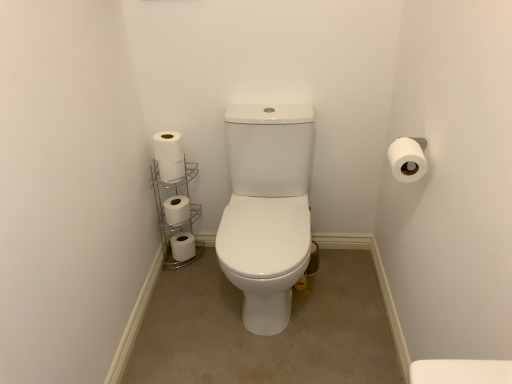
Question: Does white matte toilet paper at left, placed as the 4th toilet paper when sorted from back to front, have a greater height compared to white metallic toilet paper holder at lower left?

Choices:
 (A) no
 (B) yes

Answer: (A)

Question: Can you confirm if white matte toilet paper at left, placed as the 4th toilet paper when sorted from back to front, is positioned to the left of white metallic toilet paper holder at lower left?

Choices:
 (A) no
 (B) yes

Answer: (A)

Question: Is white metallic toilet paper holder at lower left at the back of white matte toilet paper at left, which is the 2th toilet paper from front to back?

Choices:
 (A) no
 (B) yes

Answer: (A)

Question: Is white matte toilet paper at left, acting as the 4th toilet paper starting from the left, directly adjacent to white metallic toilet paper holder at lower left?

Choices:
 (A) yes
 (B) no

Answer: (B)

Question: Can you confirm if white matte toilet paper at left, which is counted as the fifth toilet paper, starting from the bottom, is wider than white metallic toilet paper holder at lower left?

Choices:
 (A) yes
 (B) no

Answer: (B)

Question: From a real-world perspective, relative to white metallic toilet paper holder at lower left, is white matte toilet paper at left, arranged as the second toilet paper when viewed from the right, vertically above or below?

Choices:
 (A) below
 (B) above

Answer: (B)

Question: Considering the positions of point coord(161,157) and point coord(176,261), is point coord(161,157) closer or farther from the camera than point coord(176,261)?

Choices:
 (A) closer
 (B) farther

Answer: (A)

Question: Would you say white matte toilet paper at left, which is the 2th toilet paper from front to back, is inside or outside white metallic toilet paper holder at lower left?

Choices:
 (A) inside
 (B) outside

Answer: (B)

Question: From the image's perspective, is white matte toilet paper at left, which ranks as the first toilet paper in top-to-bottom order, located above or below white metallic toilet paper holder at lower left?

Choices:
 (A) below
 (B) above

Answer: (B)

Question: From a real-world perspective, is white matte toilet paper at lower left, the first toilet paper viewed from the back, physically located above or below white matte toilet paper at upper right, positioned as the 5th toilet paper in left-to-right order?

Choices:
 (A) above
 (B) below

Answer: (B)

Question: Is white matte toilet paper at lower left, arranged as the 1th toilet paper when ordered from the bottom, taller or shorter than white matte toilet paper at upper right, the third toilet paper ordered from the bottom?

Choices:
 (A) short
 (B) tall

Answer: (A)

Question: Considering the relative positions of white matte toilet paper at lower left, the first toilet paper viewed from the back, and white matte toilet paper at upper right, marked as the fifth toilet paper in a back-to-front arrangement, in the image provided, is white matte toilet paper at lower left, the first toilet paper viewed from the back, to the left or to the right of white matte toilet paper at upper right, marked as the fifth toilet paper in a back-to-front arrangement,?

Choices:
 (A) left
 (B) right

Answer: (A)

Question: Considering the positions of point (179, 258) and point (402, 170), is point (179, 258) closer or farther from the camera than point (402, 170)?

Choices:
 (A) farther
 (B) closer

Answer: (A)

Question: Is white metallic toilet paper holder at lower left spatially inside white matte toilet paper at lower left, which ranks as the 3th toilet paper in right-to-left order, or outside of it?

Choices:
 (A) outside
 (B) inside

Answer: (A)

Question: Considering the positions of white metallic toilet paper holder at lower left and white matte toilet paper at lower left, positioned as the fifth toilet paper in top-to-bottom order, in the image, is white metallic toilet paper holder at lower left bigger or smaller than white matte toilet paper at lower left, positioned as the fifth toilet paper in top-to-bottom order,?

Choices:
 (A) small
 (B) big

Answer: (B)